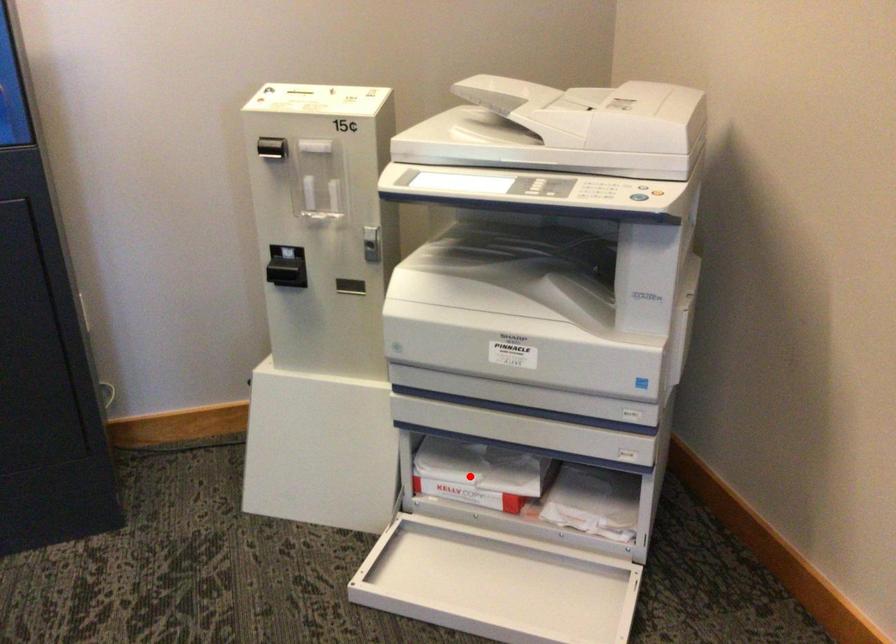
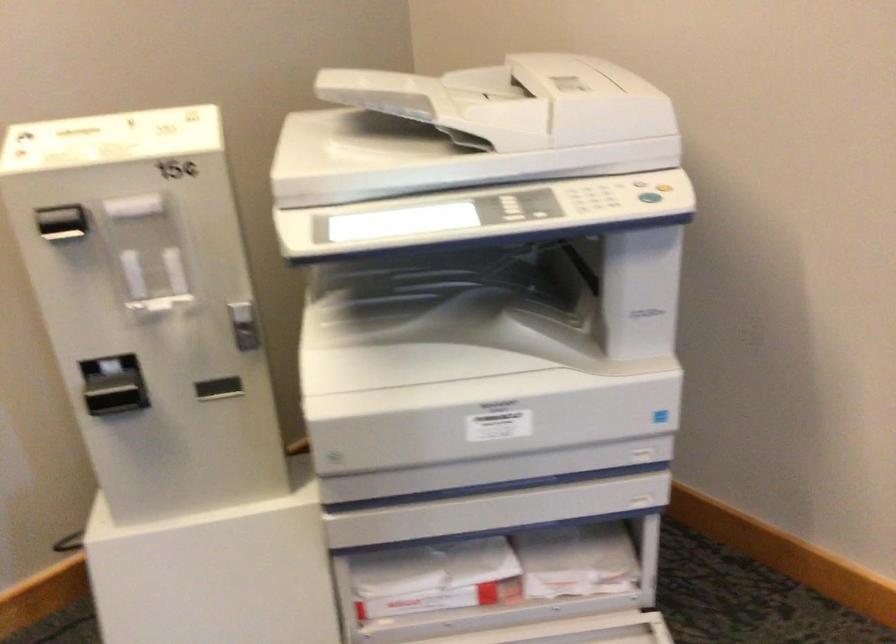
Question: I am providing you with two images of the same scene from different viewpoints. In image1, a red point is highlighted. Considering the same 3D point in image2, which of the following is correct?

Choices:
 (A) It is closer
 (B) It is farther

Answer: (A)